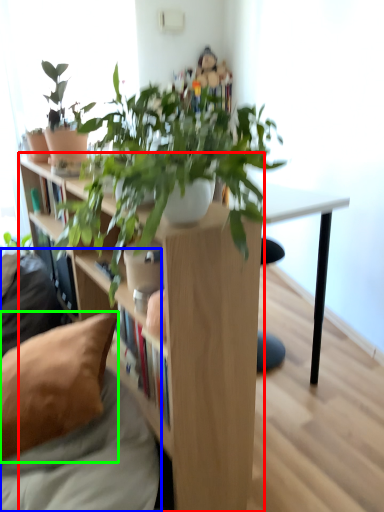
Question: Based on their relative distances, which object is nearer to shelf (highlighted by a red box)? Choose from couch (highlighted by a blue box) and pillow (highlighted by a green box).

Choices:
 (A) couch
 (B) pillow

Answer: (A)